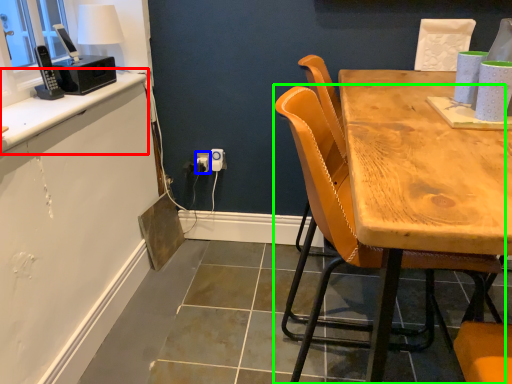
Question: Considering the real-world distances, which object is closest to counter top (highlighted by a red box)? power outlet (highlighted by a blue box) or chair (highlighted by a green box).

Choices:
 (A) power outlet
 (B) chair

Answer: (A)